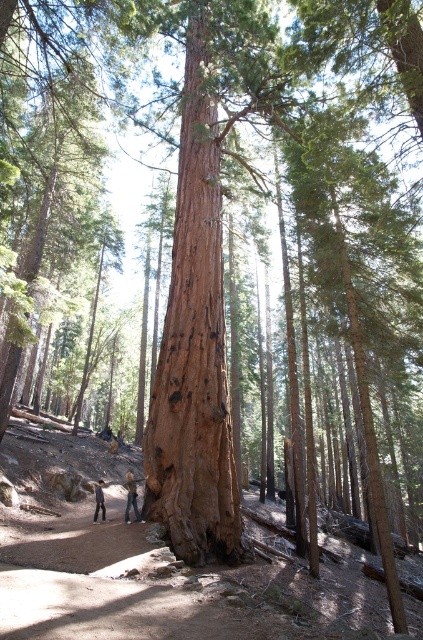
Between denim jeans at center and denim jeans at lower center, which one has less height?

With less height is denim jeans at center.

The height and width of the screenshot is (640, 423). What do you see at coordinates (131, 497) in the screenshot?
I see `denim jeans at center` at bounding box center [131, 497].

Locate an element on the screen. The width and height of the screenshot is (423, 640). denim jeans at center is located at coordinates click(x=131, y=497).